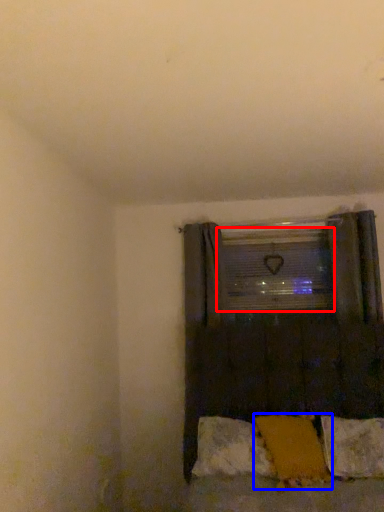
Question: Which point is closer to the camera, window screen (highlighted by a red box) or pillow (highlighted by a blue box)?

Choices:
 (A) window screen
 (B) pillow

Answer: (B)